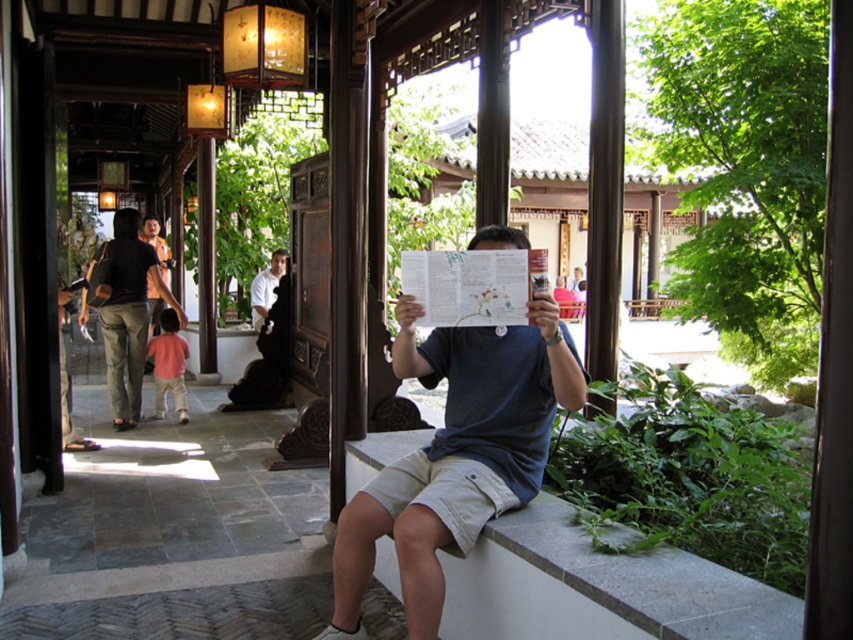
What do you see at coordinates (457, 456) in the screenshot? The image size is (853, 640). I see `dark blue t-shirt at center` at bounding box center [457, 456].

Is point (498, 504) closer to camera compared to point (125, 394)?

Yes, point (498, 504) is closer to viewer.

This screenshot has height=640, width=853. What do you see at coordinates (457, 456) in the screenshot?
I see `dark blue t-shirt at center` at bounding box center [457, 456].

At what (x,y) coordinates should I click in order to perform the action: click on dark blue t-shirt at center. Please return your answer as a coordinate pair (x, y). Looking at the image, I should click on (457, 456).

Is point (454, 467) less distant than point (173, 316)?

Yes.

Between dark blue t-shirt at center and light pink cotton shirt at lower left, which one has less height?

light pink cotton shirt at lower left is shorter.

Between point (519, 481) and point (160, 387), which one is positioned in front?

Point (519, 481)

Identify the location of dark blue t-shirt at center. The height and width of the screenshot is (640, 853). (457, 456).

Is light pink cotton shirt at lower left closer to the viewer compared to white shirt at center?

Yes, light pink cotton shirt at lower left is in front of white shirt at center.

Which is behind, point (154, 342) or point (251, 284)?

Positioned behind is point (251, 284).

Who is more distant from viewer, (172, 346) or (273, 292)?

The point (273, 292) is more distant.

Locate an element on the screen. Image resolution: width=853 pixels, height=640 pixels. light pink cotton shirt at lower left is located at coordinates (169, 364).